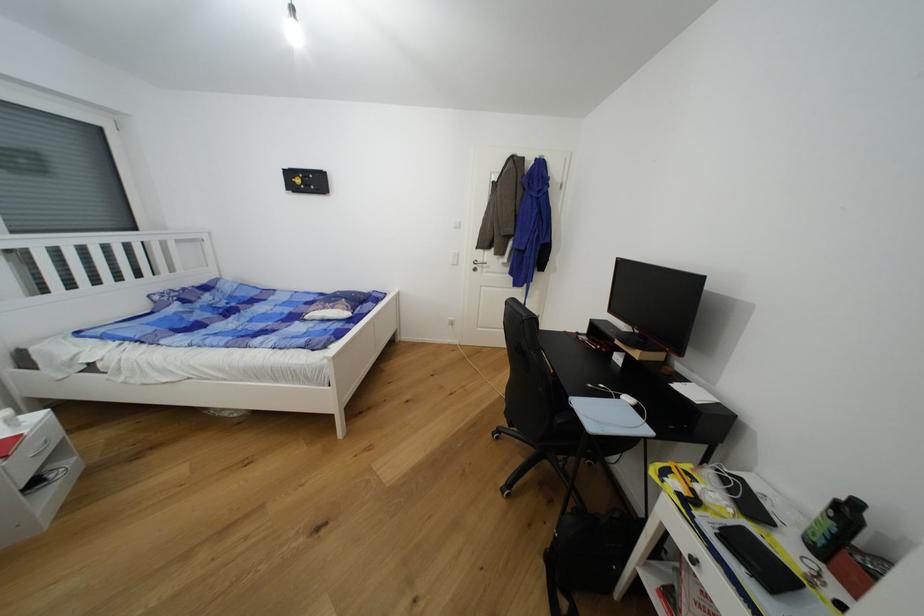
Find the location of `silver door handle`. silver door handle is located at coordinates (479, 265).